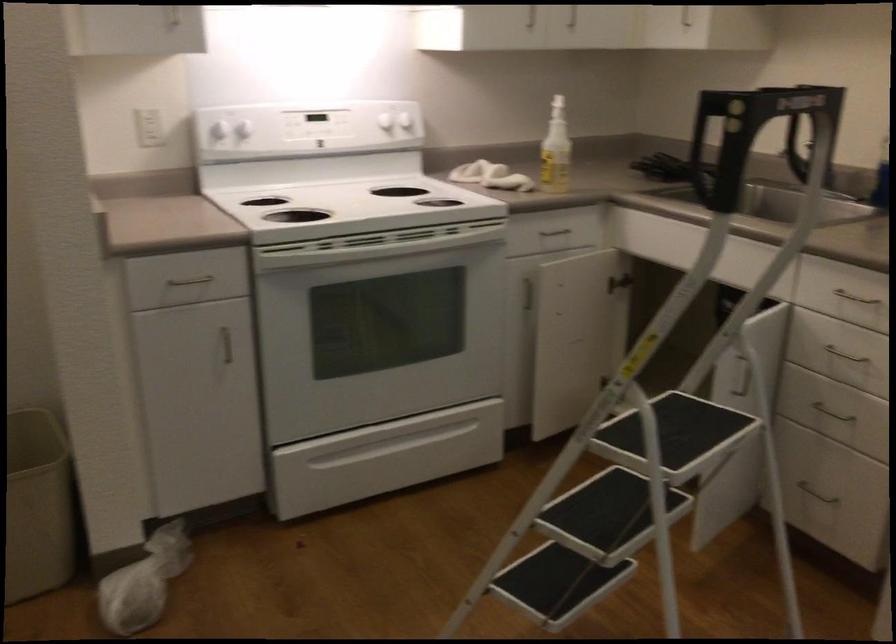
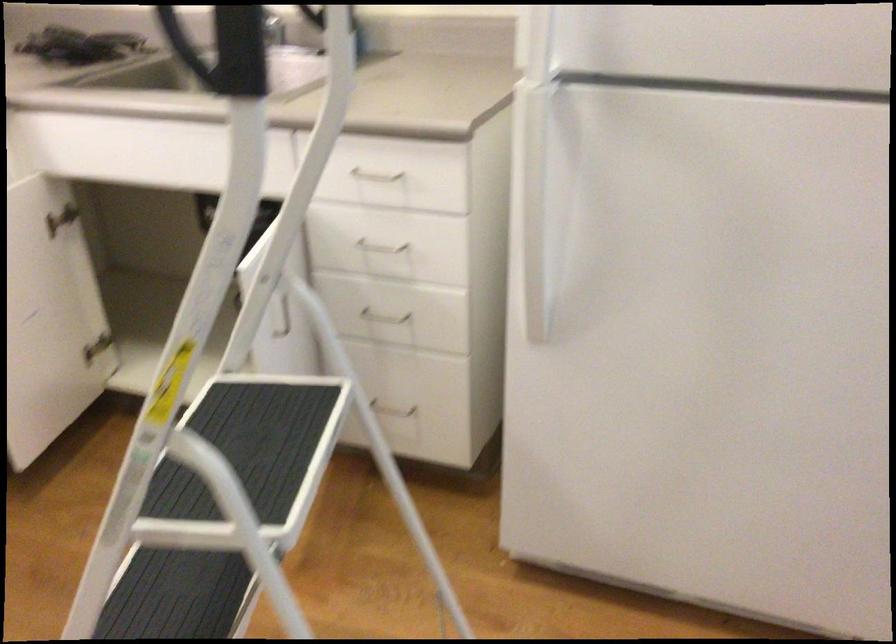
Locate, in the second image, the point that corresponds to point 615,520 in the first image.

(179, 596)